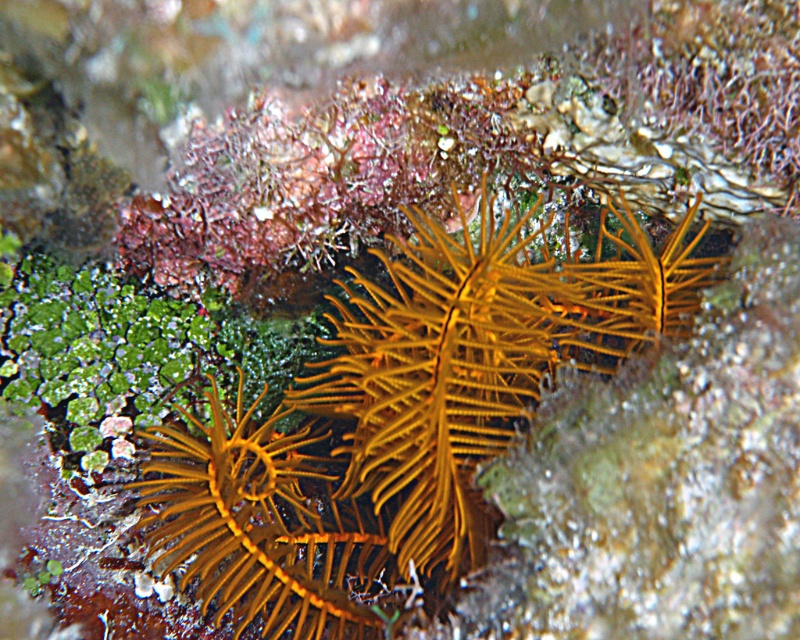
Question: Is yellow spiny anemone at center bigger than yellow matte anemone at center?

Choices:
 (A) yes
 (B) no

Answer: (A)

Question: Which point is farther from the camera taking this photo?

Choices:
 (A) (245, 509)
 (B) (398, 417)

Answer: (A)

Question: Which point is closer to the camera taking this photo?

Choices:
 (A) (632, 268)
 (B) (370, 620)

Answer: (A)

Question: Which of the following is the farthest from the observer?

Choices:
 (A) (436, 486)
 (B) (312, 604)

Answer: (B)

Question: Does yellow spiny anemone at center come in front of yellow matte anemone at center?

Choices:
 (A) yes
 (B) no

Answer: (A)

Question: Does yellow spiny anemone at center appear on the right side of yellow matte anemone at center?

Choices:
 (A) no
 (B) yes

Answer: (B)